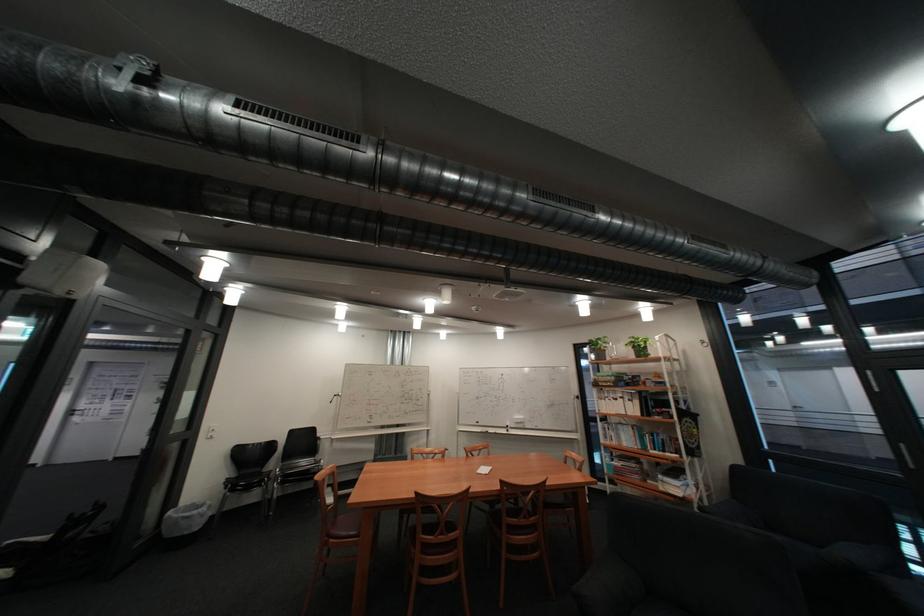
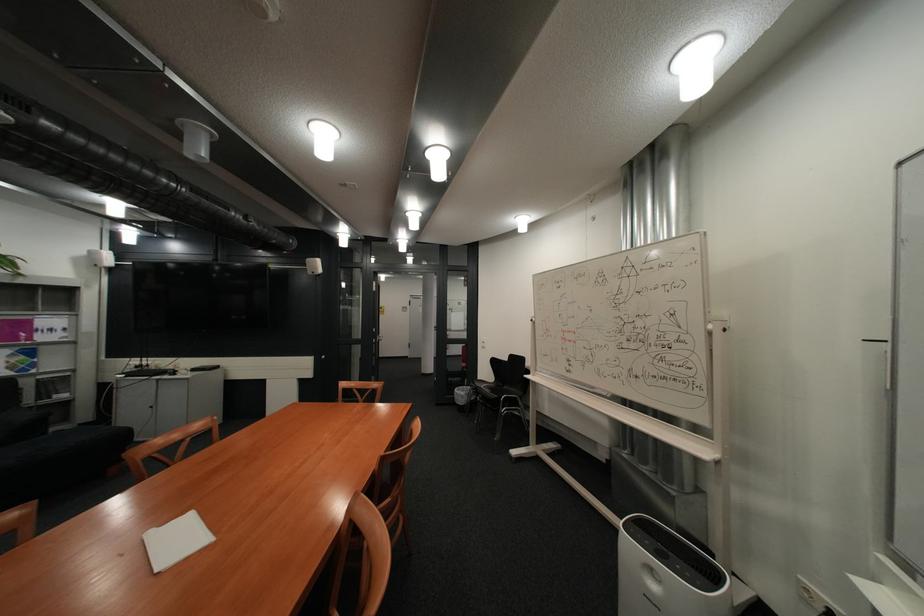
Find the pixel in the second image that matches [444,392] in the first image.

(725, 326)